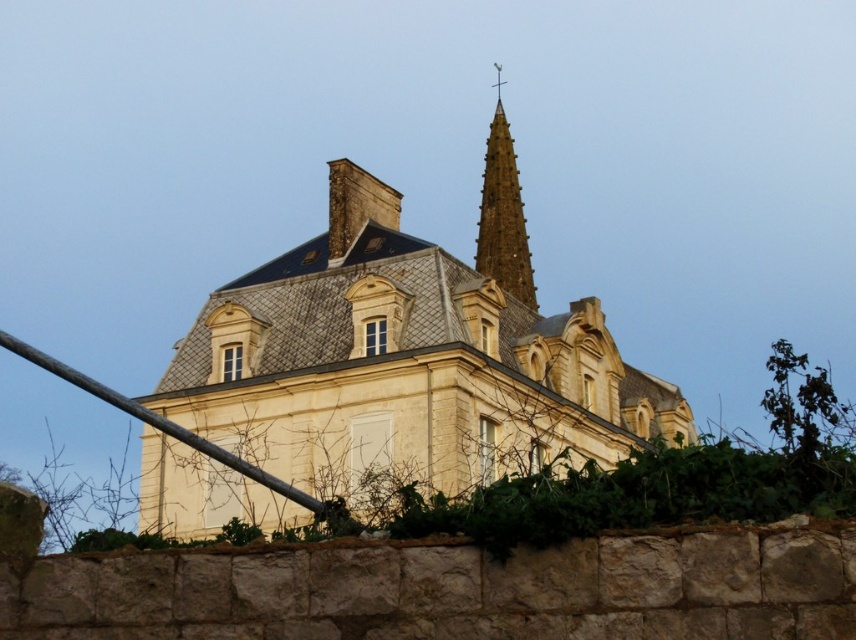
Question: Does smooth brown spire at upper center appear on the right side of metallic pole at lower left?

Choices:
 (A) yes
 (B) no

Answer: (A)

Question: Which point is closer to the camera taking this photo?

Choices:
 (A) (12, 337)
 (B) (256, 291)

Answer: (A)

Question: Which object is the farthest from the smooth brown spire at upper center?

Choices:
 (A) white stone church at center
 (B) metallic pole at lower left

Answer: (B)

Question: Can you confirm if white stone church at center is positioned to the left of metallic pole at lower left?

Choices:
 (A) yes
 (B) no

Answer: (B)

Question: Is white stone church at center below metallic pole at lower left?

Choices:
 (A) yes
 (B) no

Answer: (B)

Question: Which of these objects is positioned farthest from the metallic pole at lower left?

Choices:
 (A) smooth brown spire at upper center
 (B) white stone church at center

Answer: (A)